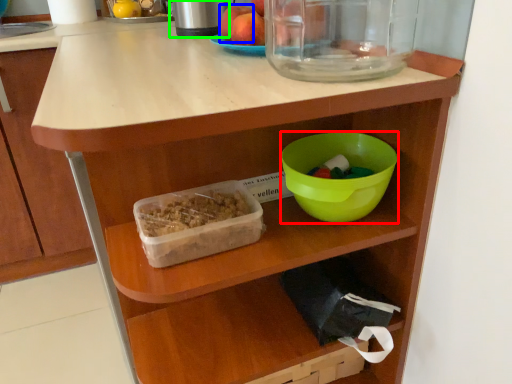
Question: Based on their relative distances, which object is nearer to bowl (highlighted by a red box)? Choose from apple (highlighted by a blue box) and appliance (highlighted by a green box).

Choices:
 (A) apple
 (B) appliance

Answer: (A)